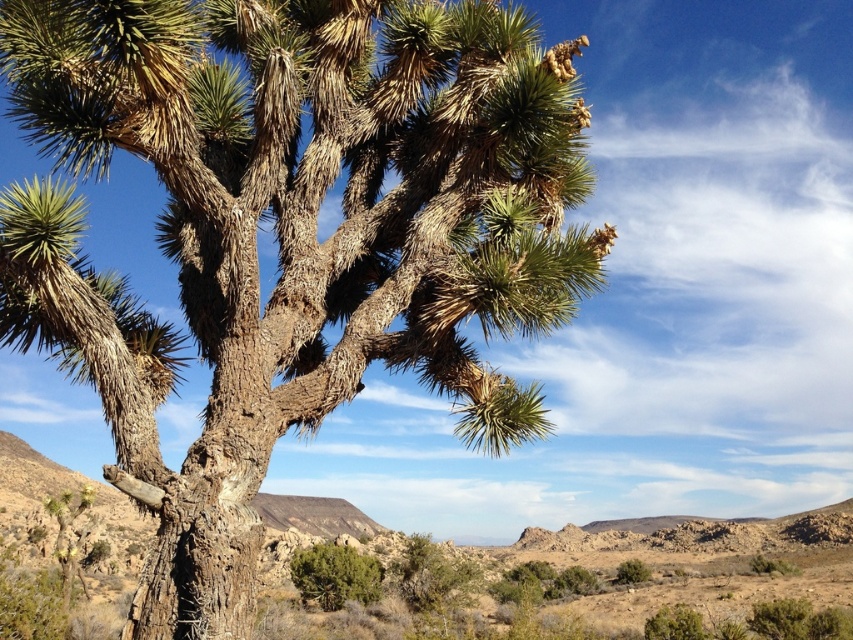
Question: Does green leafy bush at lower center come in front of green leafy bush at lower right?

Choices:
 (A) yes
 (B) no

Answer: (A)

Question: Estimate the real-world distances between objects in this image. Which object is farther from the green leafy bush at lower right?

Choices:
 (A) brown rough desert at center
 (B) brown rough bark tree at center

Answer: (B)

Question: Is brown rough bark tree at center positioned before brown rough desert at center?

Choices:
 (A) no
 (B) yes

Answer: (B)

Question: Is brown rough desert at center wider than brown textured cactus at lower left?

Choices:
 (A) no
 (B) yes

Answer: (B)

Question: Which point appears closest to the camera in this image?

Choices:
 (A) (67, 580)
 (B) (376, 561)
 (C) (90, 605)

Answer: (A)

Question: Which point appears closest to the camera in this image?

Choices:
 (A) (646, 573)
 (B) (543, 278)
 (C) (341, 579)

Answer: (B)